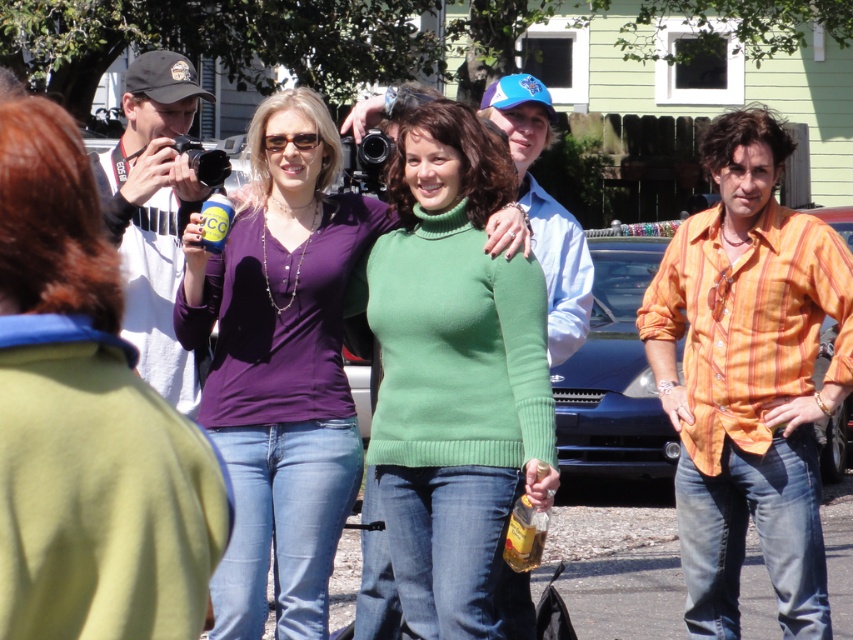
You are a photographer trying to decide which item to place in your bag first. The matte black camera at left and the orange striped shirt at right are both in your sight. Which item is smaller and should be packed first to save space?

The matte black camera at left is smaller than the orange striped shirt at right, so it should be packed first to save space.

You are a photographer trying to capture a closeup shot of the two points in the image. Which point, point [415,493] or point [119,236], is closer to your camera?

Point [415,493] is closer to the camera than point [119,236].

You are a photographer trying to position your matte black camera at left for a portrait shot. The ideal position for the camera is at point 0.66, 0.10 on the coordinate system. Is your current position close enough to capture the subjects effectively?

The matte black camera at left is positioned exactly at point (86, 422), which is very close to the ideal coordinates of (84, 422). This position should allow for effective capture of the subjects.